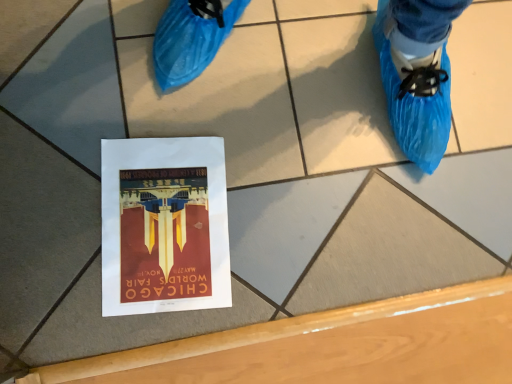
Image resolution: width=512 pixels, height=384 pixels. Identify the location of vacant space to the right of matte paper poster at center. (283, 262).